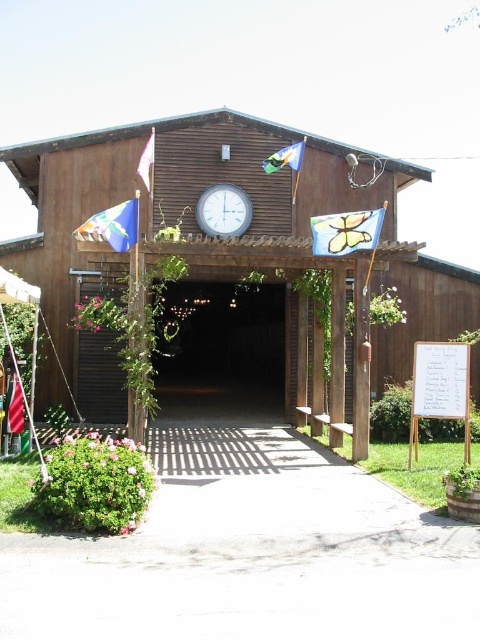
Question: Among these objects, which one is farthest from the camera?

Choices:
 (A) black matte door at center
 (B) white fabric flag at upper left
 (C) white plastic clock at center
 (D) dark wood door at center

Answer: (D)

Question: Estimate the real-world distances between objects in this image. Which object is closer to the butterfly fabric flag at center?

Choices:
 (A) red fabric flag at left
 (B) blue fabric flag at upper center

Answer: (B)

Question: Observing the image, what is the correct spatial positioning of blue fabric flag at left in reference to blue fabric flag at upper center?

Choices:
 (A) left
 (B) right

Answer: (A)

Question: Is white plastic clock at center thinner than white fabric flag at upper left?

Choices:
 (A) yes
 (B) no

Answer: (B)

Question: Is dark wood door at center closer to the viewer compared to red fabric flag at left?

Choices:
 (A) no
 (B) yes

Answer: (A)

Question: Among these objects, which one is farthest from the camera?

Choices:
 (A) red fabric flag at left
 (B) brown wooden barn at center
 (C) white plastic clock at center

Answer: (C)